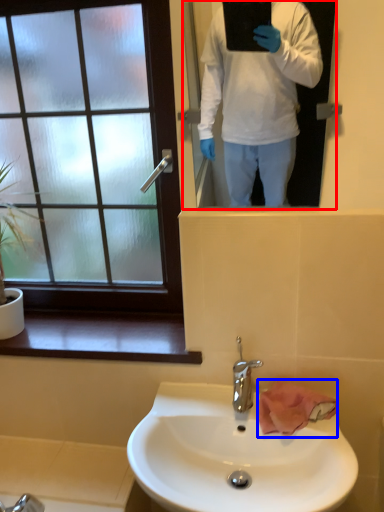
Question: Which object appears farthest to the camera in this image, mirror (highlighted by a red box) or hand towel (highlighted by a blue box)?

Choices:
 (A) mirror
 (B) hand towel

Answer: (B)